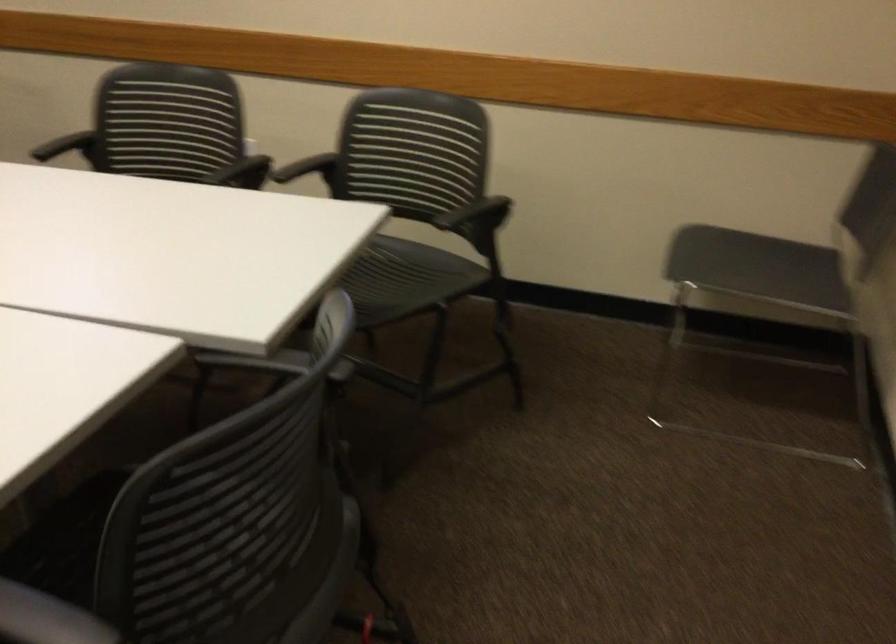
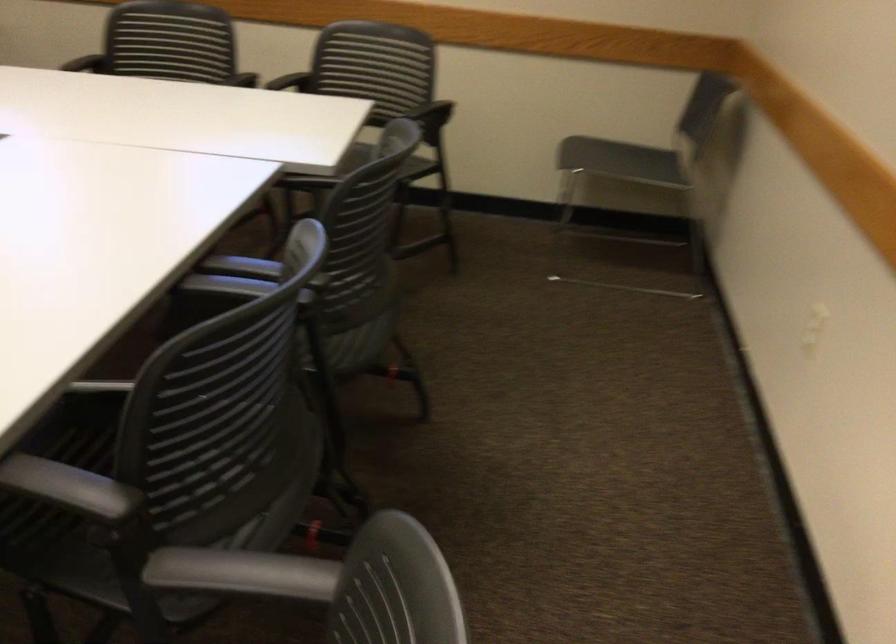
Locate, in the second image, the point that corresponds to (x=480, y=220) in the first image.

(433, 118)